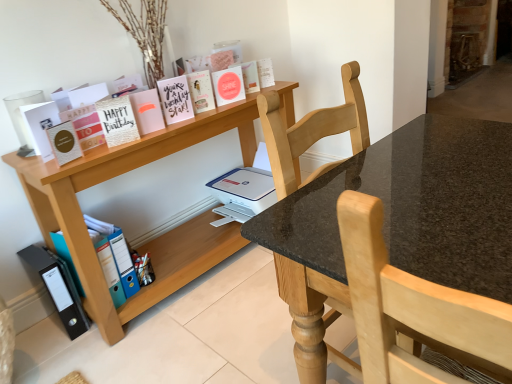
At what (x,y) coordinates should I click in order to perform the action: click on vacant area that lies to the right of matte pink card at upper center, the sixth paperback book when ordered from left to right. Please return your answer as a coordinate pair (x, y). This screenshot has width=512, height=384. Looking at the image, I should click on (208, 114).